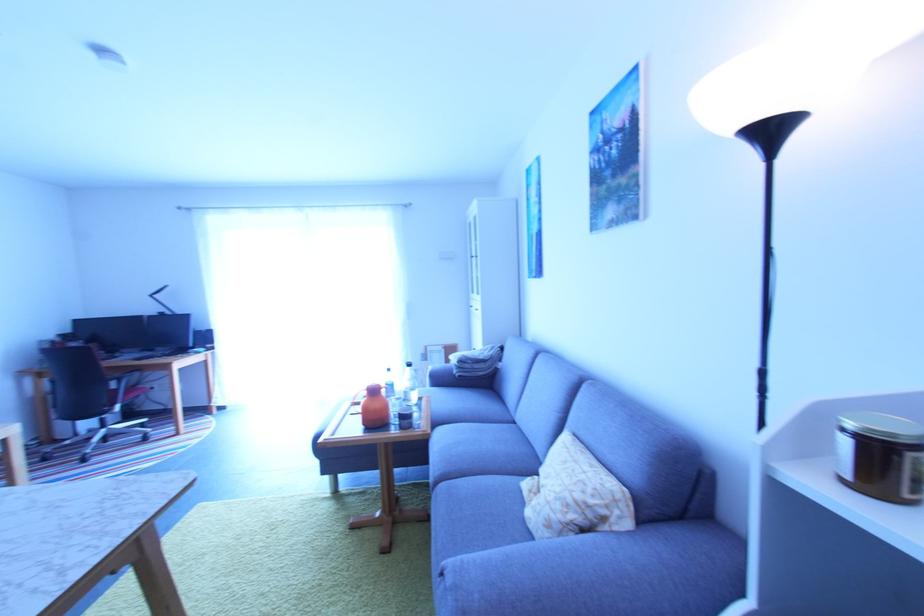
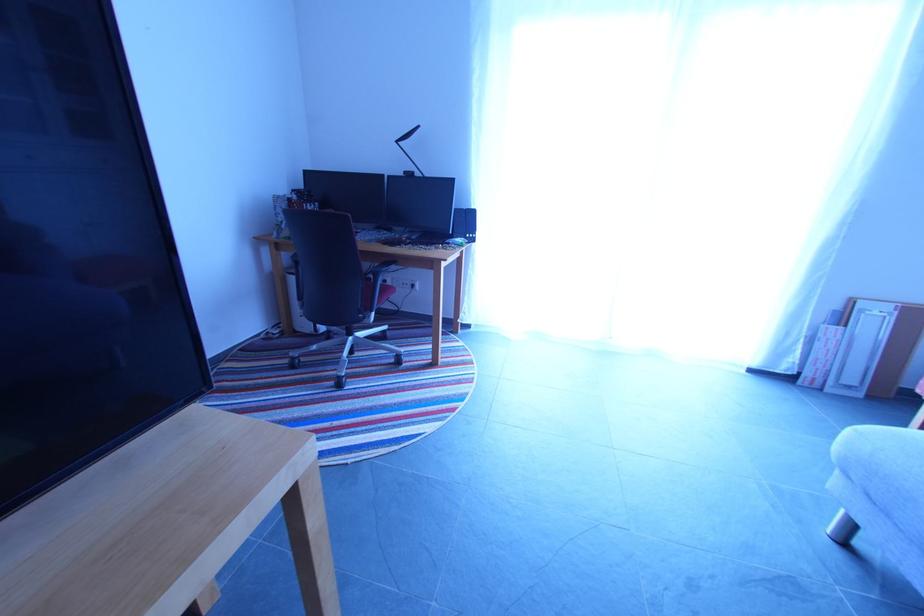
The images are taken continuously from a first-person perspective. In which direction are you moving?

The movement direction of the cameraman is left, forward.